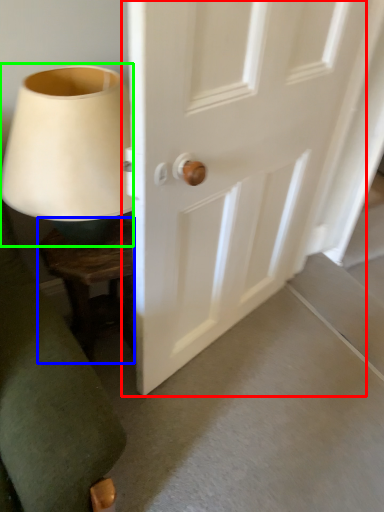
Question: Estimate the real-world distances between objects in this image. Which object is farther from door (highlighted by a red box), furniture (highlighted by a blue box) or table lamp (highlighted by a green box)?

Choices:
 (A) furniture
 (B) table lamp

Answer: (A)